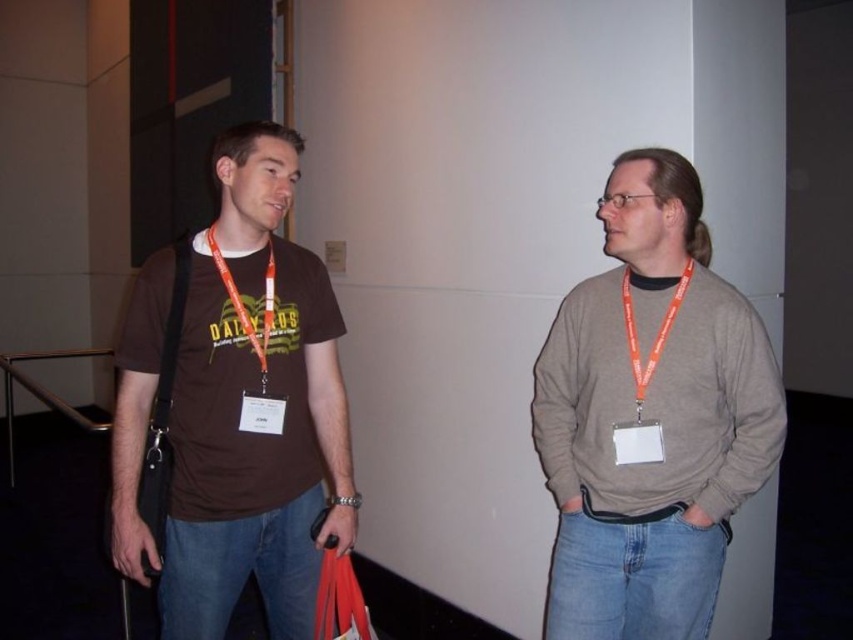
Based on the photo, you are at a conference and need to locate the registration desk. You notice two lanyards in the image. Which one is closer to you, the matte orange lanyard at center or the orange fabric lanyard at left?

The matte orange lanyard at center is closer to you because it is in front of the orange fabric lanyard at left.

You are standing in front of the two people at the conference. You want to know which of the two points, point (213, 604) or point (253, 205), is closer to you. Can you determine this based on their positions?

Point (213, 604) is further to the camera than point (253, 205), so point (253, 205) is closer to you.